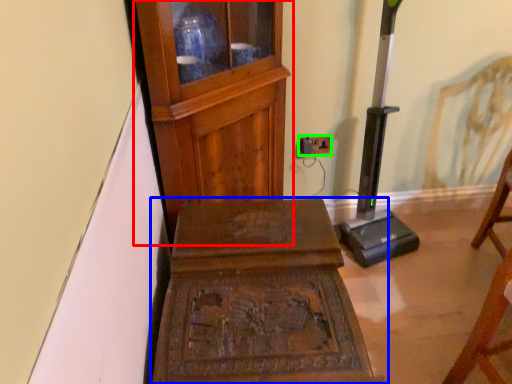
Question: Based on their relative distances, which object is farther from furniture (highlighted by a red box)? Choose from furniture (highlighted by a blue box) and electric outlet (highlighted by a green box).

Choices:
 (A) furniture
 (B) electric outlet

Answer: (B)